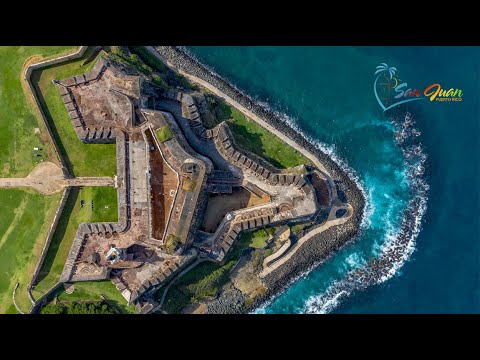
Find the location of `wall`. wall is located at coordinates (48, 64), (48, 287).